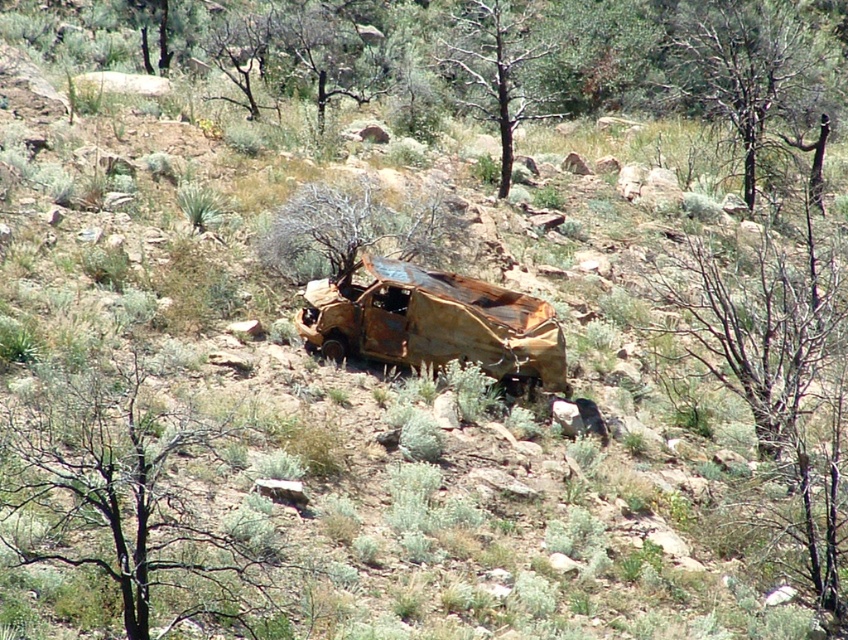
Who is more distant from viewer, (335,346) or (491,84)?

The point (491,84) is behind.

Is rusty metal vehicle at center further to the viewer compared to brown bark tree at center?

No.

Locate an element on the screen. rusty metal vehicle at center is located at coordinates (433, 323).

The width and height of the screenshot is (848, 640). Find the location of `rusty metal vehicle at center`. rusty metal vehicle at center is located at coordinates (433, 323).

Is point (54, 445) positioned in front of point (500, 310)?

Yes.

Does charred wood tree at center have a smaller size compared to rusty metal vehicle at center?

Correct, charred wood tree at center occupies less space than rusty metal vehicle at center.

This screenshot has height=640, width=848. I want to click on charred wood tree at center, so click(x=127, y=499).

Image resolution: width=848 pixels, height=640 pixels. What are the coordinates of `charred wood tree at center` in the screenshot? It's located at (127, 499).

Based on the photo, does brown dry wood at center have a lesser height compared to brown bark tree at center?

Yes, brown dry wood at center is shorter than brown bark tree at center.

Based on the photo, measure the distance between brown dry wood at center and brown bark tree at center.

brown dry wood at center and brown bark tree at center are 10.90 meters apart from each other.

This screenshot has height=640, width=848. What do you see at coordinates (352, 230) in the screenshot? I see `brown dry wood at center` at bounding box center [352, 230].

Locate an element on the screen. brown dry wood at center is located at coordinates (352, 230).